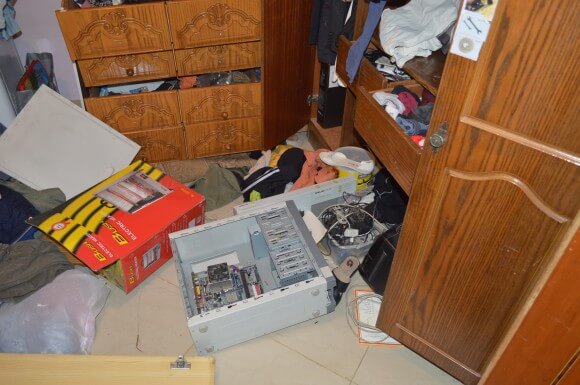
Where is `brown hardwood door`? The height and width of the screenshot is (385, 580). brown hardwood door is located at coordinates (466, 254).